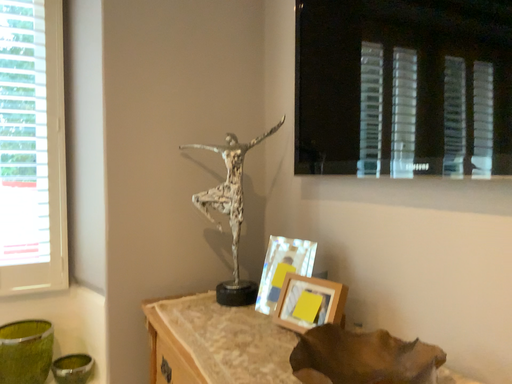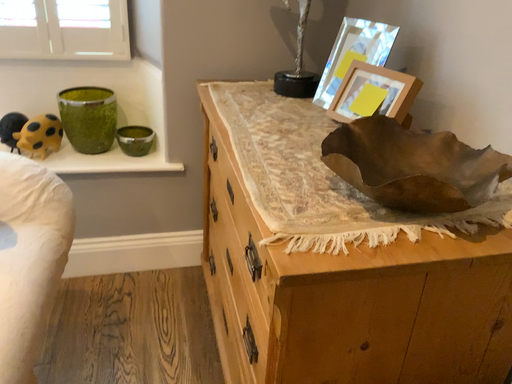
Question: How did the camera likely rotate when shooting the video?

Choices:
 (A) rotated downward
 (B) rotated upward

Answer: (A)